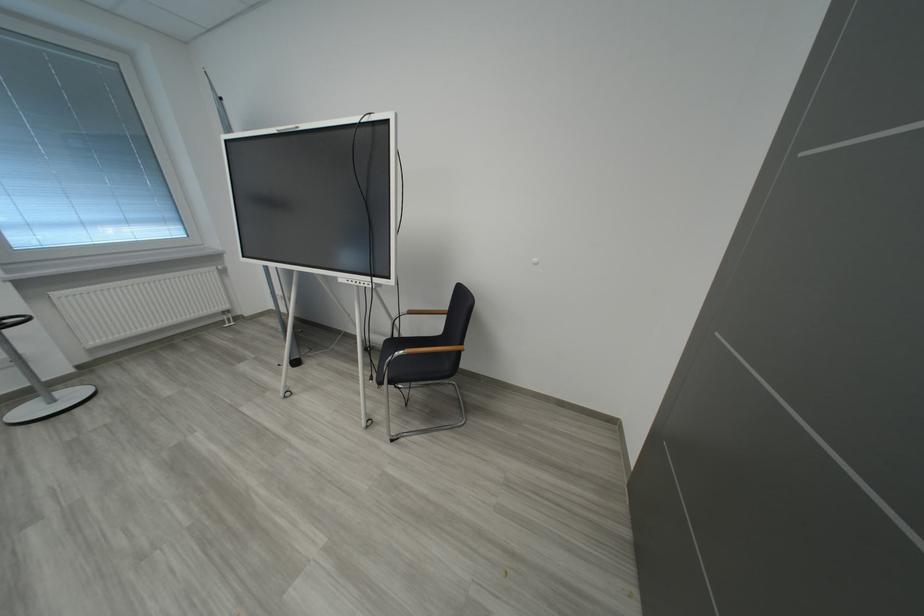
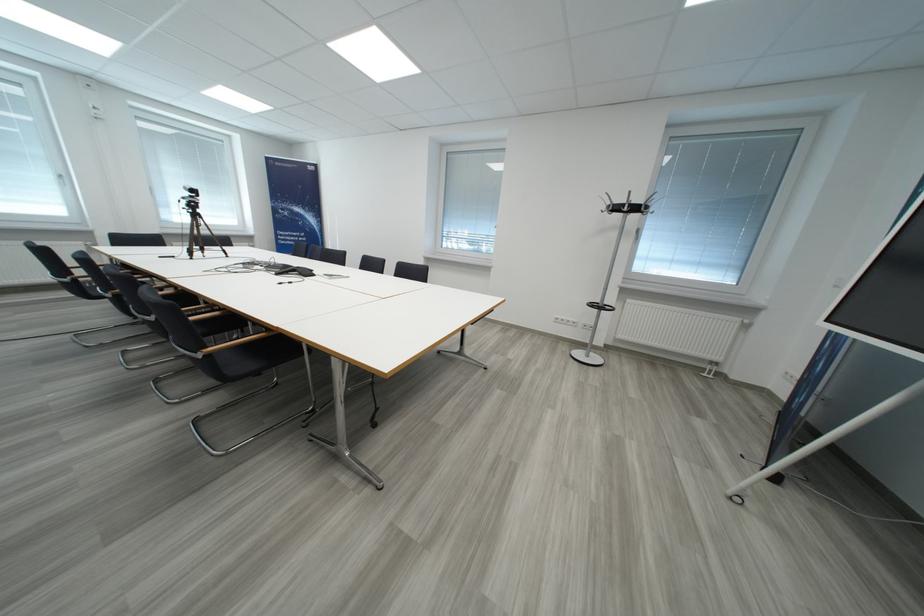
The first image is from the beginning of the video and the second image is from the end. How did the camera likely rotate when shooting the video?

The rotation direction of the camera is left-down.